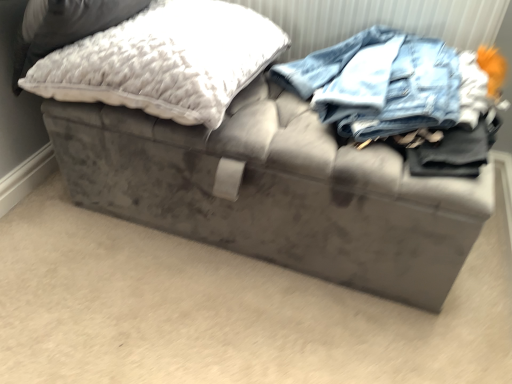
Question: Should I look upward or downward to see white fluffy pillow at upper left, which is the second pillow in right-to-left order?

Choices:
 (A) down
 (B) up

Answer: (B)

Question: Is white fluffy pillow at upper left, which is the 1th pillow from right to left, far away from white fluffy pillow at upper left, which is the second pillow in right-to-left order?

Choices:
 (A) no
 (B) yes

Answer: (A)

Question: From the image's perspective, would you say white fluffy pillow at upper left, which is counted as the 2th pillow, starting from the left, is shown under white fluffy pillow at upper left, positioned as the 1th pillow in left-to-right order?

Choices:
 (A) no
 (B) yes

Answer: (B)

Question: From a real-world perspective, is white fluffy pillow at upper left, which is counted as the 2th pillow, starting from the left, over white fluffy pillow at upper left, positioned as the 1th pillow in left-to-right order?

Choices:
 (A) no
 (B) yes

Answer: (A)

Question: Considering the relative positions of white fluffy pillow at upper left, which is counted as the 2th pillow, starting from the left, and white fluffy pillow at upper left, positioned as the 1th pillow in left-to-right order, in the image provided, is white fluffy pillow at upper left, which is counted as the 2th pillow, starting from the left, to the left of white fluffy pillow at upper left, positioned as the 1th pillow in left-to-right order, from the viewer's perspective?

Choices:
 (A) yes
 (B) no

Answer: (B)

Question: Is the position of white fluffy pillow at upper left, which is the 1th pillow from right to left, more distant than that of white fluffy pillow at upper left, which is the second pillow in right-to-left order?

Choices:
 (A) yes
 (B) no

Answer: (A)

Question: Could you tell me if white fluffy pillow at upper left, which is the 1th pillow from right to left, is turned towards white fluffy pillow at upper left, which is the second pillow in right-to-left order?

Choices:
 (A) no
 (B) yes

Answer: (A)

Question: Considering the relative sizes of white fluffy pillow at upper left, positioned as the 1th pillow in left-to-right order, and white fluffy pillow at upper left, which is the 1th pillow from right to left, in the image provided, is white fluffy pillow at upper left, positioned as the 1th pillow in left-to-right order, taller than white fluffy pillow at upper left, which is the 1th pillow from right to left,?

Choices:
 (A) yes
 (B) no

Answer: (B)

Question: Can you confirm if white fluffy pillow at upper left, positioned as the 1th pillow in left-to-right order, is shorter than white fluffy pillow at upper left, which is the 1th pillow from right to left?

Choices:
 (A) no
 (B) yes

Answer: (B)

Question: Is white fluffy pillow at upper left, which is the second pillow in right-to-left order, thinner than white fluffy pillow at upper left, which is counted as the 2th pillow, starting from the left?

Choices:
 (A) yes
 (B) no

Answer: (B)

Question: From a real-world perspective, is white fluffy pillow at upper left, positioned as the 1th pillow in left-to-right order, under white fluffy pillow at upper left, which is counted as the 2th pillow, starting from the left?

Choices:
 (A) no
 (B) yes

Answer: (A)

Question: Could you tell me if white fluffy pillow at upper left, positioned as the 1th pillow in left-to-right order, is facing white fluffy pillow at upper left, which is counted as the 2th pillow, starting from the left?

Choices:
 (A) no
 (B) yes

Answer: (A)

Question: Is white fluffy pillow at upper left, which is the second pillow in right-to-left order, far away from white fluffy pillow at upper left, which is counted as the 2th pillow, starting from the left?

Choices:
 (A) no
 (B) yes

Answer: (A)

Question: In terms of width, does white fluffy pillow at upper left, positioned as the 1th pillow in left-to-right order, look wider or thinner when compared to white fluffy pillow at upper left, which is counted as the 2th pillow, starting from the left?

Choices:
 (A) thin
 (B) wide

Answer: (B)